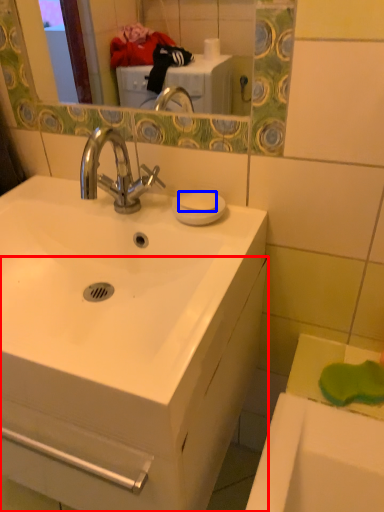
Question: Which of the following is the closest to the observer, bathroom cabinet (highlighted by a red box) or soap (highlighted by a blue box)?

Choices:
 (A) bathroom cabinet
 (B) soap

Answer: (A)